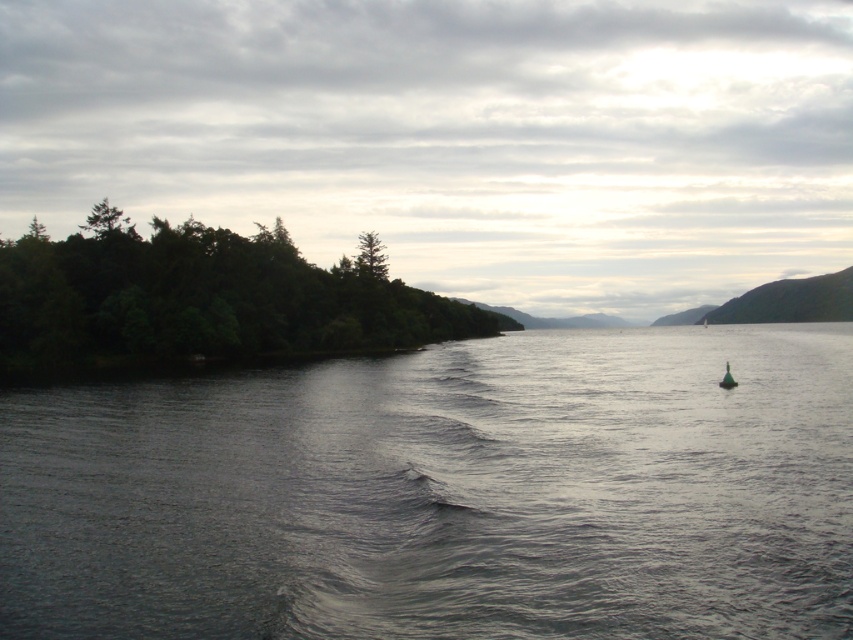
Question: Which point appears farthest from the camera in this image?

Choices:
 (A) (727, 387)
 (B) (466, 410)

Answer: (A)

Question: Can you confirm if green leafy trees at left is positioned below green matte buoy at lower right?

Choices:
 (A) yes
 (B) no

Answer: (B)

Question: Is dark gray water at center bigger than green matte buoy at lower right?

Choices:
 (A) no
 (B) yes

Answer: (B)

Question: Which object is closer to the camera taking this photo?

Choices:
 (A) dark gray water at center
 (B) green matte buoy at lower right

Answer: (A)

Question: Which object is the closest to the dark gray water at center?

Choices:
 (A) green leafy trees at left
 (B) green matte buoy at lower right

Answer: (B)

Question: Is dark gray water at center above green matte buoy at lower right?

Choices:
 (A) yes
 (B) no

Answer: (B)